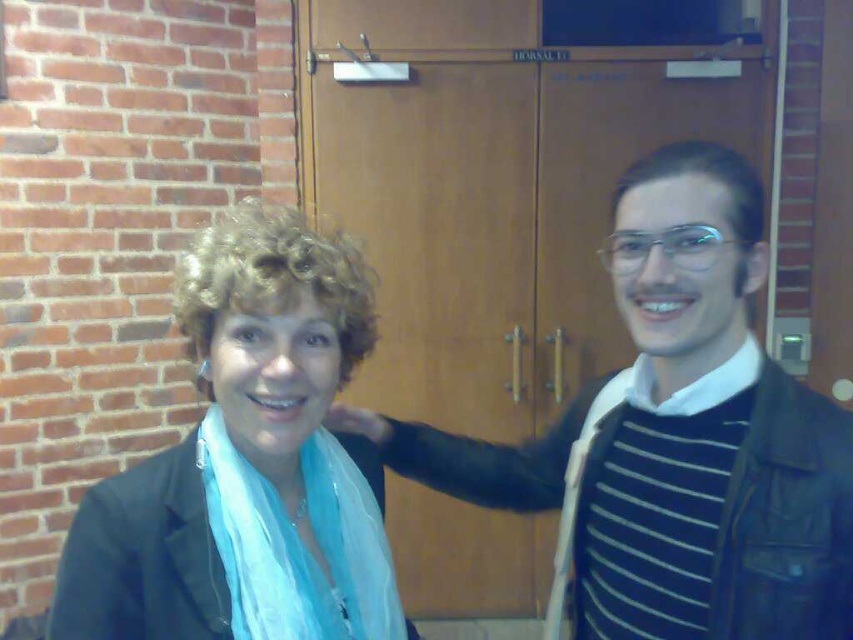
Between matte black jacket at left and light blue silky scarf at center, which one is positioned lower?

light blue silky scarf at center

Find the location of a particular element. The width and height of the screenshot is (853, 640). matte black jacket at left is located at coordinates (247, 461).

Between striped knit sweater at center and matte black jacket at left, which one appears on the right side from the viewer's perspective?

striped knit sweater at center is more to the right.

What do you see at coordinates (708, 435) in the screenshot?
I see `striped knit sweater at center` at bounding box center [708, 435].

The image size is (853, 640). In order to click on striped knit sweater at center in this screenshot , I will do `click(708, 435)`.

Is point (352, 416) positioned before point (328, 595)?

No, (352, 416) is behind (328, 595).

Who is positioned more to the left, striped knit sweater at center or light blue silky scarf at center?

From the viewer's perspective, light blue silky scarf at center appears more on the left side.

Find the location of a particular element. Image resolution: width=853 pixels, height=640 pixels. striped knit sweater at center is located at coordinates (708, 435).

Locate an element on the screen. striped knit sweater at center is located at coordinates (708, 435).